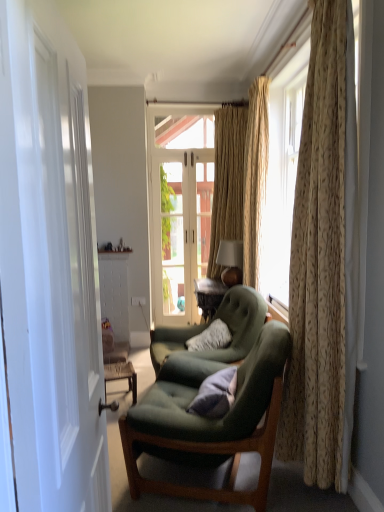
Question: Could you tell me if green fabric couch at center is facing green fabric chair at center, positioned as the first chair in front-to-back order?

Choices:
 (A) yes
 (B) no

Answer: (B)

Question: Is green fabric couch at center facing away from green fabric chair at center, positioned as the first chair in front-to-back order?

Choices:
 (A) no
 (B) yes

Answer: (A)

Question: From the image's perspective, is green fabric couch at center below green fabric chair at center, the second chair positioned from the back?

Choices:
 (A) yes
 (B) no

Answer: (A)

Question: Is green fabric couch at center closer to the viewer compared to green fabric chair at center, positioned as the first chair in front-to-back order?

Choices:
 (A) no
 (B) yes

Answer: (A)

Question: Considering the relative positions of green fabric couch at center and green fabric chair at center, positioned as the first chair in front-to-back order, in the image provided, is green fabric couch at center to the right of green fabric chair at center, positioned as the first chair in front-to-back order, from the viewer's perspective?

Choices:
 (A) yes
 (B) no

Answer: (B)

Question: Is point (205, 204) positioned closer to the camera than point (266, 381)?

Choices:
 (A) farther
 (B) closer

Answer: (A)

Question: From a real-world perspective, relative to green fabric chair at center, positioned as the first chair in front-to-back order, is white glass door at center vertically above or below?

Choices:
 (A) above
 (B) below

Answer: (A)

Question: In the image, is white glass door at center on the left side or the right side of green fabric chair at center, the second chair positioned from the back?

Choices:
 (A) right
 (B) left

Answer: (B)

Question: Looking at their shapes, would you say white glass door at center is wider or thinner than green fabric chair at center, the second chair positioned from the back?

Choices:
 (A) thin
 (B) wide

Answer: (A)

Question: In terms of height, does velvet purple pillow at center look taller or shorter compared to green fabric chair at center, the second chair positioned from the back?

Choices:
 (A) tall
 (B) short

Answer: (B)

Question: In the image, is velvet purple pillow at center positioned in front of or behind green fabric chair at center, positioned as the first chair in front-to-back order?

Choices:
 (A) behind
 (B) front

Answer: (A)

Question: From the image's perspective, is velvet purple pillow at center located above or below green fabric chair at center, the second chair positioned from the back?

Choices:
 (A) above
 (B) below

Answer: (A)

Question: Is velvet purple pillow at center wider or thinner than green fabric chair at center, positioned as the first chair in front-to-back order?

Choices:
 (A) thin
 (B) wide

Answer: (A)

Question: From a real-world perspective, relative to matte gold lampshade at upper right, is velvet green armchair at center, which is the 2th chair from front to back, vertically above or below?

Choices:
 (A) above
 (B) below

Answer: (B)

Question: From the image's perspective, is velvet green armchair at center, which is the 2th chair from front to back, located above or below matte gold lampshade at upper right?

Choices:
 (A) above
 (B) below

Answer: (B)